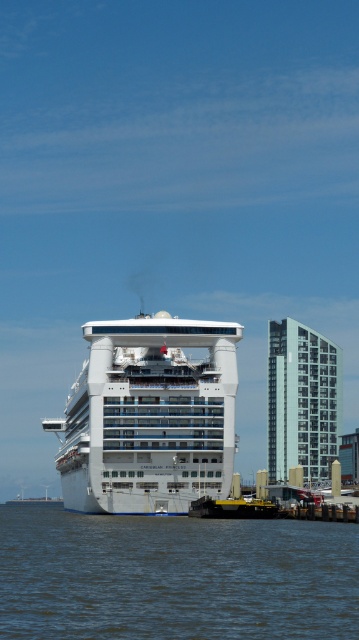
Question: Does brown water at lower left have a larger size compared to white glossy cruise ship at center?

Choices:
 (A) no
 (B) yes

Answer: (A)

Question: Among these objects, which one is nearest to the camera?

Choices:
 (A) white glossy cruise ship at center
 (B) brown water at lower left

Answer: (B)

Question: Is brown water at lower left in front of white glossy cruise ship at center?

Choices:
 (A) no
 (B) yes

Answer: (B)

Question: Does brown water at lower left have a larger size compared to white glossy cruise ship at center?

Choices:
 (A) no
 (B) yes

Answer: (A)